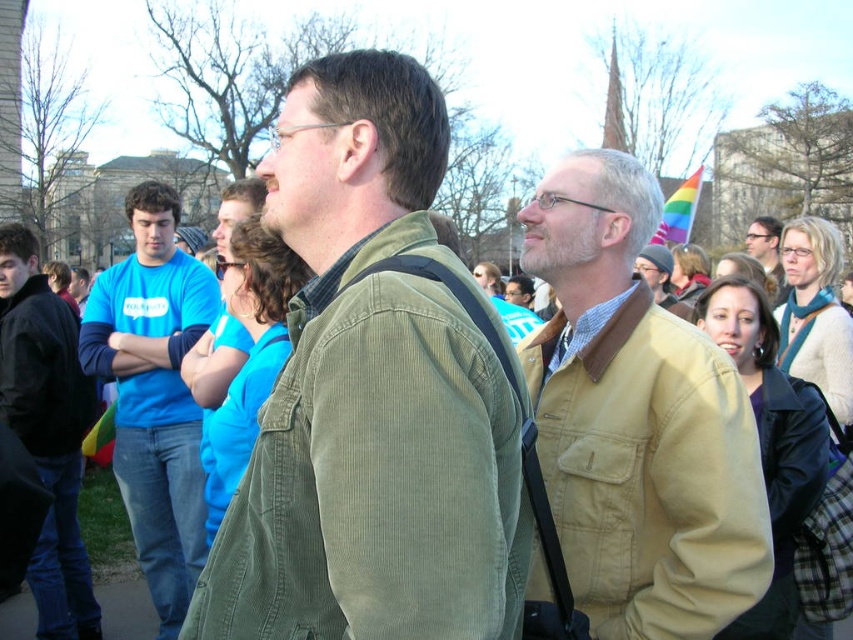
You are taking a photo of the two points in the image. Which point, point (231, 560) or point (16, 436), will appear larger in your photo?

Point (231, 560) will appear larger in the photo because it is closer to the camera than point (16, 436).

You are a photographer standing at point (549, 465). You want to take a photo of the two men in the scene. Can you fit both of them in your camera frame which has a 2.5 meter width?

The two men are 3.16 meters apart, so no, the camera frame with a 2.5 meter width cannot fit both of them as they are farther apart than the frame width.

You are organizing a photo shoot and need to arrange two jackets for a fashion spread. The khaki corduroy jacket at upper right and the light brown leather jacket at center are available. If you want to place them side by side on a mannequin stand, which jacket should you choose if you want the one that takes up less space?

The khaki corduroy jacket at upper right occupies less space than the light brown leather jacket at center, so you should choose the khaki corduroy jacket at upper right for the mannequin stand if you want the one that takes up less space.